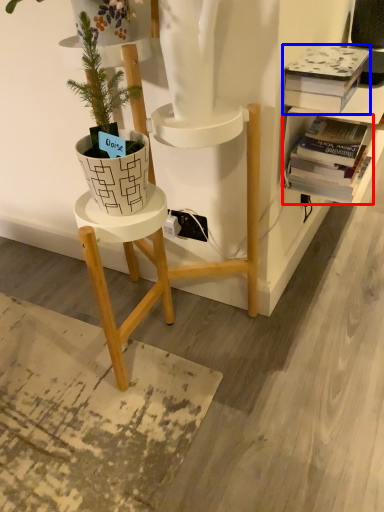
Question: Which object is closer to the camera taking this photo, book (highlighted by a red box) or book (highlighted by a blue box)?

Choices:
 (A) book
 (B) book

Answer: (B)